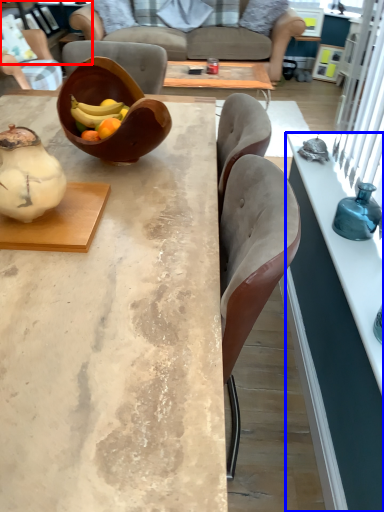
Question: Which object appears closest to the camera in this image, cabinetry (highlighted by a red box) or desk (highlighted by a blue box)?

Choices:
 (A) cabinetry
 (B) desk

Answer: (B)